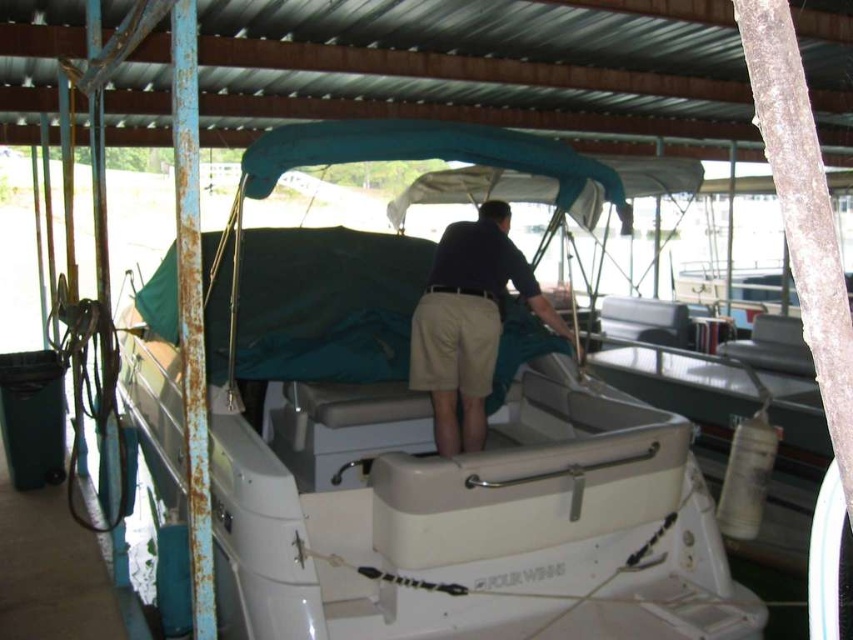
From the picture: Which is below, white plastic boat at center or dark blue shirt at center?

dark blue shirt at center

Between white plastic boat at center and dark blue shirt at center, which one has less height?

Standing shorter between the two is dark blue shirt at center.

What do you see at coordinates (436, 472) in the screenshot?
I see `white plastic boat at center` at bounding box center [436, 472].

You are a GUI agent. You are given a task and a screenshot of the screen. Output one action in this format:
    pyautogui.click(x=<x>, y=<y>)
    Task: Click on the white plastic boat at center
    
    Given the screenshot: What is the action you would take?
    pyautogui.click(x=436, y=472)